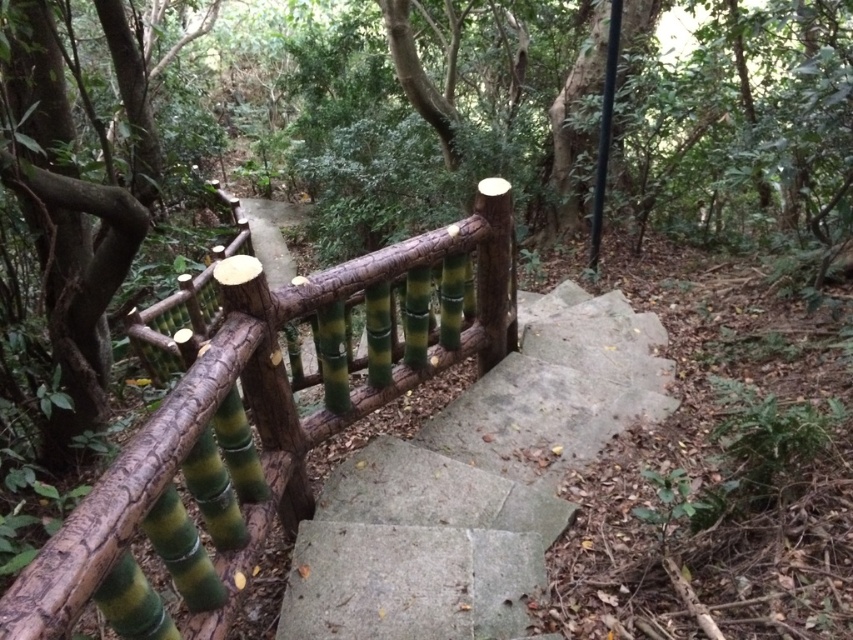
Question: Is green bamboo railing at left smaller than smooth concrete stairs at center?

Choices:
 (A) yes
 (B) no

Answer: (B)

Question: Is green bamboo railing at left above smooth concrete stairs at center?

Choices:
 (A) yes
 (B) no

Answer: (A)

Question: Among these objects, which one is farthest from the camera?

Choices:
 (A) smooth concrete stairs at center
 (B) green bamboo railing at left

Answer: (A)

Question: Among these objects, which one is nearest to the camera?

Choices:
 (A) smooth concrete stairs at center
 (B) green bamboo railing at left

Answer: (B)

Question: Does green bamboo railing at left appear under smooth concrete stairs at center?

Choices:
 (A) no
 (B) yes

Answer: (A)